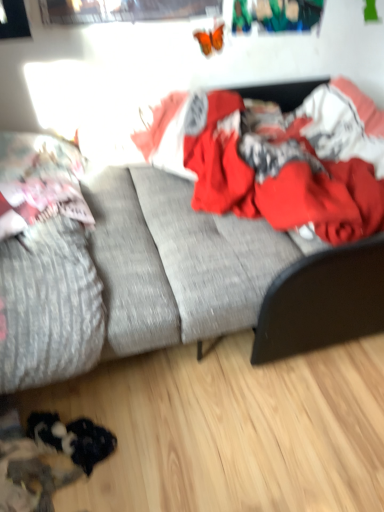
Question: Is textured gray couch at center smaller than red cotton blanket at center?

Choices:
 (A) yes
 (B) no

Answer: (B)

Question: Is textured gray couch at center to the left of red cotton blanket at center from the viewer's perspective?

Choices:
 (A) no
 (B) yes

Answer: (B)

Question: Is textured gray couch at center not close to red cotton blanket at center?

Choices:
 (A) yes
 (B) no

Answer: (B)

Question: Does textured gray couch at center contain red cotton blanket at center?

Choices:
 (A) no
 (B) yes

Answer: (B)

Question: Is textured gray couch at center positioned in front of red cotton blanket at center?

Choices:
 (A) yes
 (B) no

Answer: (A)

Question: Considering the positions of point (41, 153) and point (329, 184), is point (41, 153) closer or farther from the camera than point (329, 184)?

Choices:
 (A) closer
 (B) farther

Answer: (B)

Question: From the image's perspective, is fluffy pink pillow at left located above or below red cotton blanket at center?

Choices:
 (A) above
 (B) below

Answer: (B)

Question: Based on their positions, is fluffy pink pillow at left located to the left or right of red cotton blanket at center?

Choices:
 (A) right
 (B) left

Answer: (B)

Question: In terms of size, does fluffy pink pillow at left appear bigger or smaller than red cotton blanket at center?

Choices:
 (A) big
 (B) small

Answer: (B)

Question: Does point (x=11, y=330) appear closer or farther from the camera than point (x=140, y=147)?

Choices:
 (A) closer
 (B) farther

Answer: (A)

Question: Would you say textured gray mattress at left is to the left or to the right of red cotton blanket at center in the picture?

Choices:
 (A) right
 (B) left

Answer: (B)

Question: Looking at the image, does textured gray mattress at left seem bigger or smaller compared to red cotton blanket at center?

Choices:
 (A) big
 (B) small

Answer: (B)

Question: From a real-world perspective, relative to red cotton blanket at center, is textured gray mattress at left vertically above or below?

Choices:
 (A) below
 (B) above

Answer: (A)

Question: From a real-world perspective, relative to textured gray mattress at left, is fluffy pink pillow at left vertically above or below?

Choices:
 (A) above
 (B) below

Answer: (A)

Question: Is fluffy pink pillow at left taller or shorter than textured gray mattress at left?

Choices:
 (A) tall
 (B) short

Answer: (B)